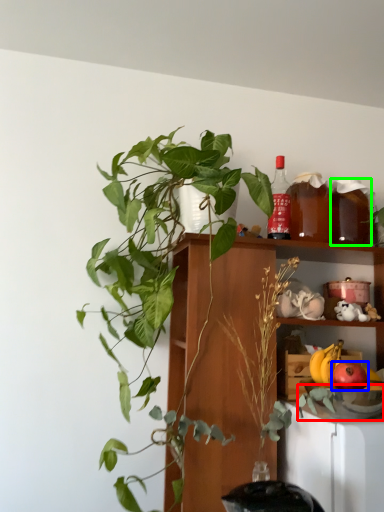
Question: Which object is the farthest from glass bowl (highlighted by a red box)? Choose among these: apple (highlighted by a blue box) or beverage (highlighted by a green box).

Choices:
 (A) apple
 (B) beverage

Answer: (B)